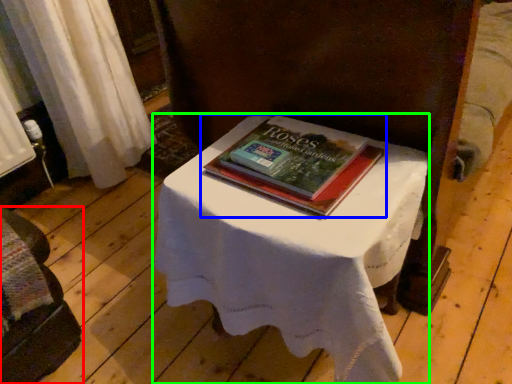
Question: Which object is positioned farthest from furniture (highlighted by a red box)? Select from book (highlighted by a blue box) and table (highlighted by a green box).

Choices:
 (A) book
 (B) table

Answer: (A)